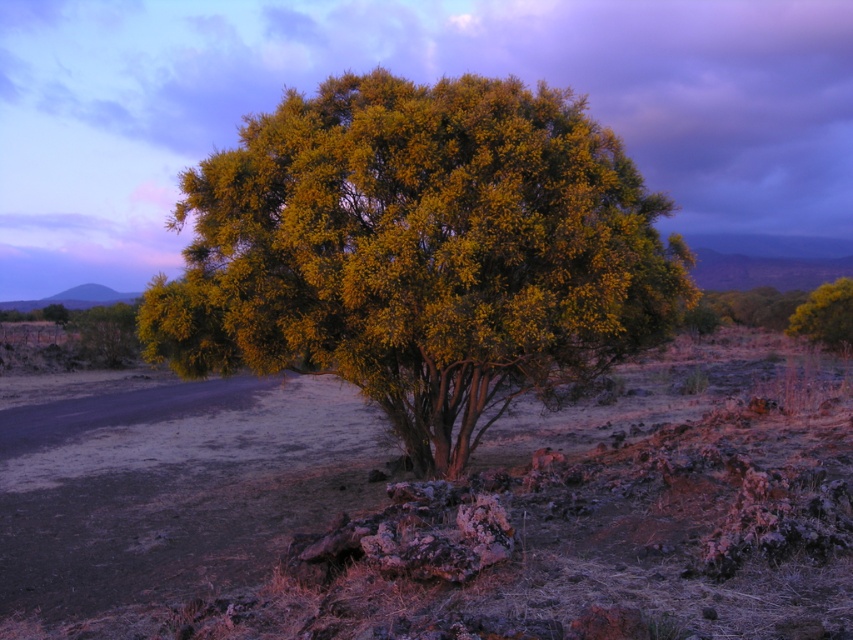
Question: Which point is closer to the camera taking this photo?

Choices:
 (A) (514, 300)
 (B) (189, 472)

Answer: (A)

Question: Which point is farther from the camera taking this photo?

Choices:
 (A) (531, 198)
 (B) (602, 550)

Answer: (A)

Question: From the image, what is the correct spatial relationship of dull brown dirt at center in relation to yellow-green leafy tree at upper right?

Choices:
 (A) right
 (B) left

Answer: (B)

Question: Where is dull brown dirt at center located in relation to yellow-green leafy tree at upper right in the image?

Choices:
 (A) left
 (B) right

Answer: (A)

Question: Which point is farther to the camera?

Choices:
 (A) dull brown dirt at center
 (B) yellow-green leafy tree at upper right

Answer: (B)

Question: Does dull brown dirt at center have a larger size compared to yellow-green foliage at center?

Choices:
 (A) yes
 (B) no

Answer: (A)